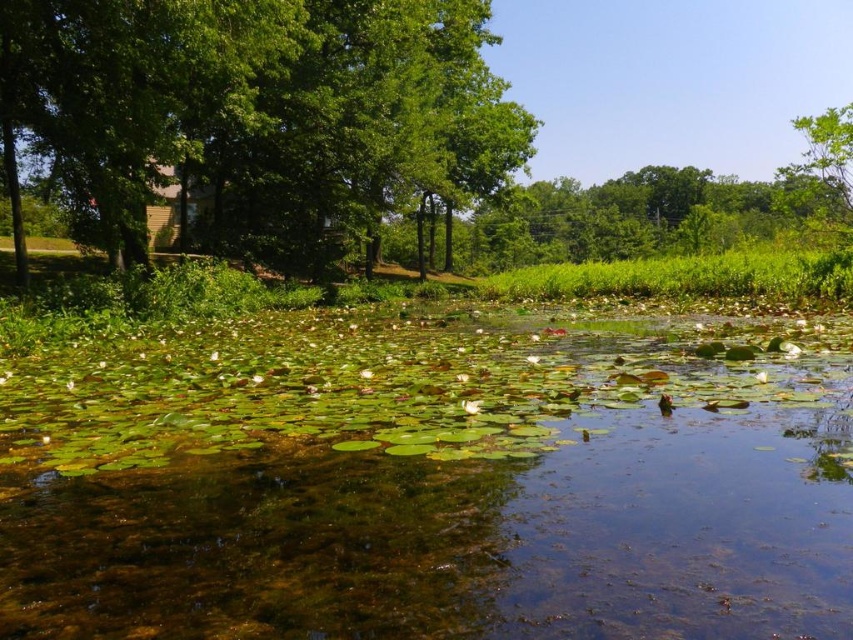
You are a bird seeking shelter in the trees. Which tree would you choose if you want to be closer to the ground? Please select between the green leafy tree at upper left and the green leafy tree at upper right.

The green leafy tree at upper left is shorter than the green leafy tree at upper right, so you should choose the green leafy tree at upper left to be closer to the ground.

You are standing at the edge of the pond and want to take a photo of the green leafy water at center and the green leafy tree at upper left. Which object is closer to the ground?

The green leafy water at center is located below the green leafy tree at upper left, so it is closer to the ground than the tree.

You are standing at the edge of the pond and want to walk towards the two points marked in the image. Which point, point (457, 499) or point (393, 156), will you reach first?

Point (457, 499) is in front of point (393, 156), so you will reach point (457, 499) first.